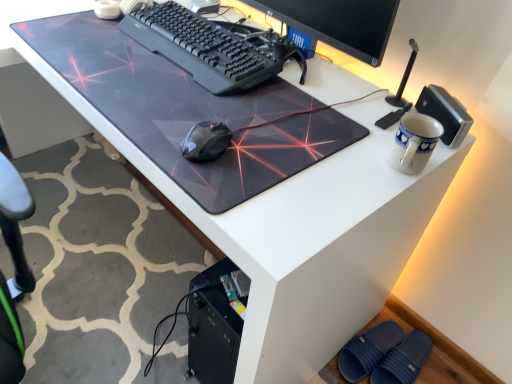
I want to click on empty space that is in between blue ceramic mug at upper right and transparent plastic mousepad at center, so click(332, 170).